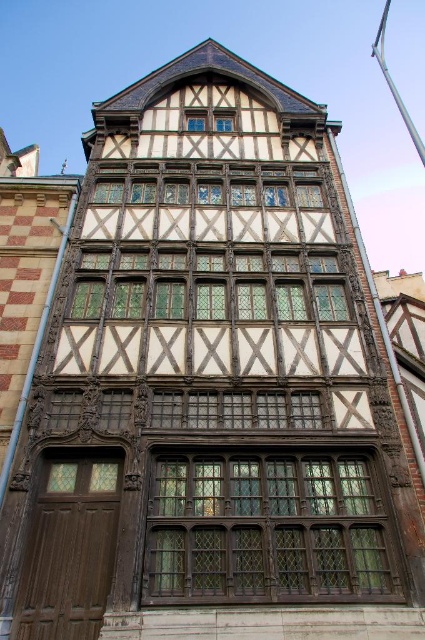
Question: Can you confirm if wooden lattice window at center is positioned above matte wood window at center?

Choices:
 (A) yes
 (B) no

Answer: (B)

Question: Which object appears closest to the camera in this image?

Choices:
 (A) matte wood window at center
 (B) wooden lattice window at center

Answer: (B)

Question: Where is wooden lattice window at center located in relation to matte wood window at center in the image?

Choices:
 (A) right
 (B) left

Answer: (A)

Question: Is wooden lattice window at center to the right of matte wood window at center from the viewer's perspective?

Choices:
 (A) yes
 (B) no

Answer: (A)

Question: Which of the following is the farthest from the observer?

Choices:
 (A) matte wood window at center
 (B) wooden lattice window at center

Answer: (A)